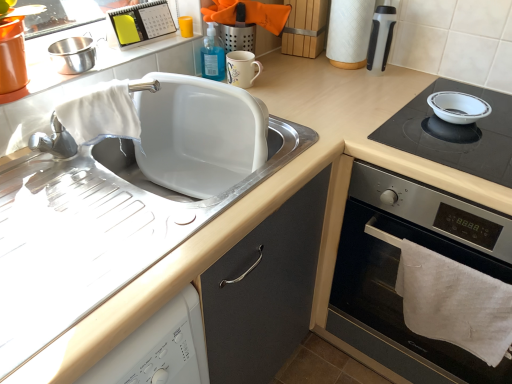
Question: From a real-world perspective, is black glass cooktop at right above or below white glossy bowl at upper right?

Choices:
 (A) below
 (B) above

Answer: (A)

Question: Is black glass cooktop at right taller or shorter than white glossy bowl at upper right?

Choices:
 (A) tall
 (B) short

Answer: (A)

Question: Based on their relative distances, which object is farther from the white matte sink at upper left?

Choices:
 (A) white plastic calendar at upper center, the 3th appliance positioned from the right
 (B) white matte sink at left
 (C) white paper towel at upper right
 (D) matte ceramic mug at upper center, the 2th appliance in the right-to-left sequence
 (E) white glossy bowl at upper right

Answer: (E)

Question: Which object is positioned farthest from the white plastic calendar at upper center, the 3th appliance positioned from the right?

Choices:
 (A) white matte sink at left
 (B) stainless steel bowl at upper left, the first appliance from the left
 (C) white matte sink at upper left
 (D) white glossy bowl at upper right
 (E) matte ceramic mug at upper center, acting as the third appliance starting from the left

Answer: (D)